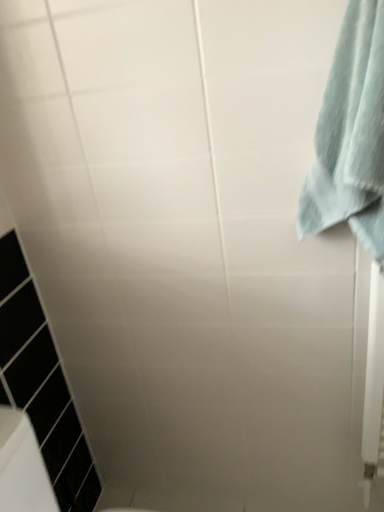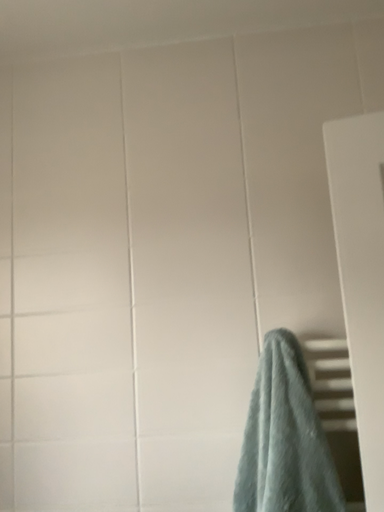
Question: Which way did the camera rotate in the video?

Choices:
 (A) rotated downward
 (B) rotated upward

Answer: (B)